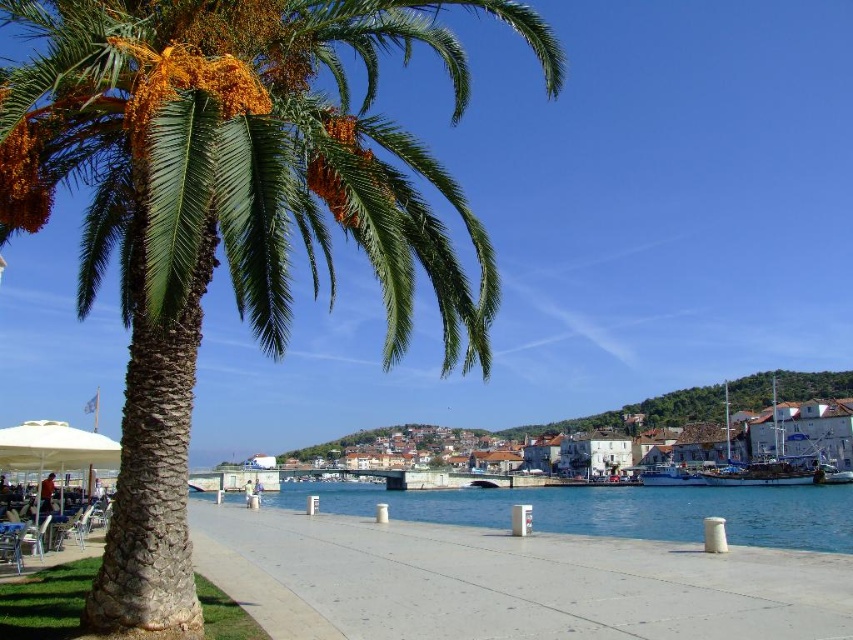
You are a tourist standing at the waterfront and want to take a photo of the clear blue water at lower center and the white stone buildings at center. Based on their positions, which one should you focus on first to ensure both are in the frame?

The clear blue water at lower center is positioned over the white stone buildings at center, so you should focus on the clear blue water at lower center first to ensure both are in the frame.

Based on the photo, you are a landscape architect designing a new garden. You have a space where you need to place both the green leafy palm tree at left and the concrete at center. Given their sizes, which object should be placed first to ensure proper spacing?

The green leafy palm tree at left is larger in size than the concrete at center, so it should be placed first to ensure proper spacing.

You are standing at the waterfront and want to take a photo of both the clear blue water at lower center and the white stone buildings at center. Which object should you focus on first to ensure both are in focus?

You should focus on the white stone buildings at center first because they are farther away than the clear blue water at lower center, so adjusting focus from near to far will help both be in focus.